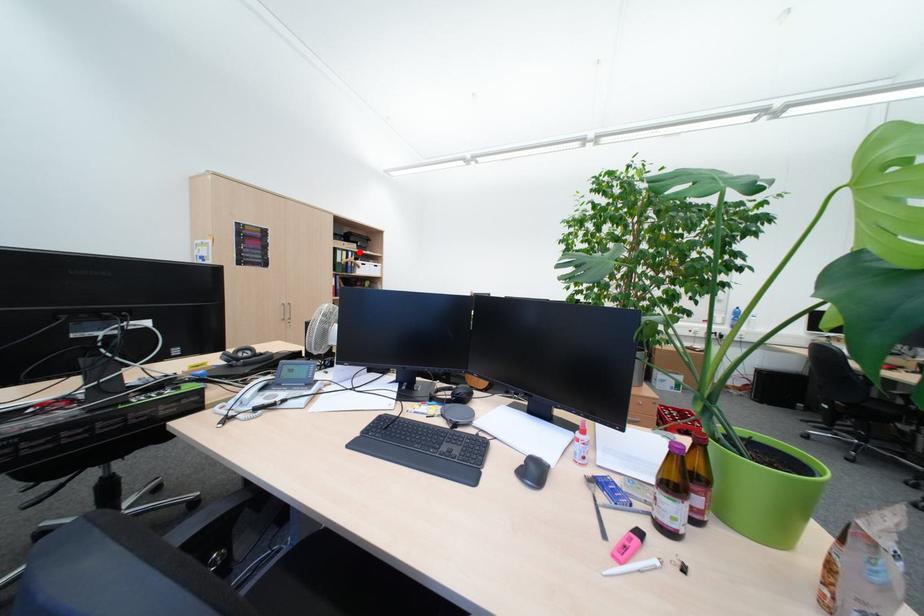
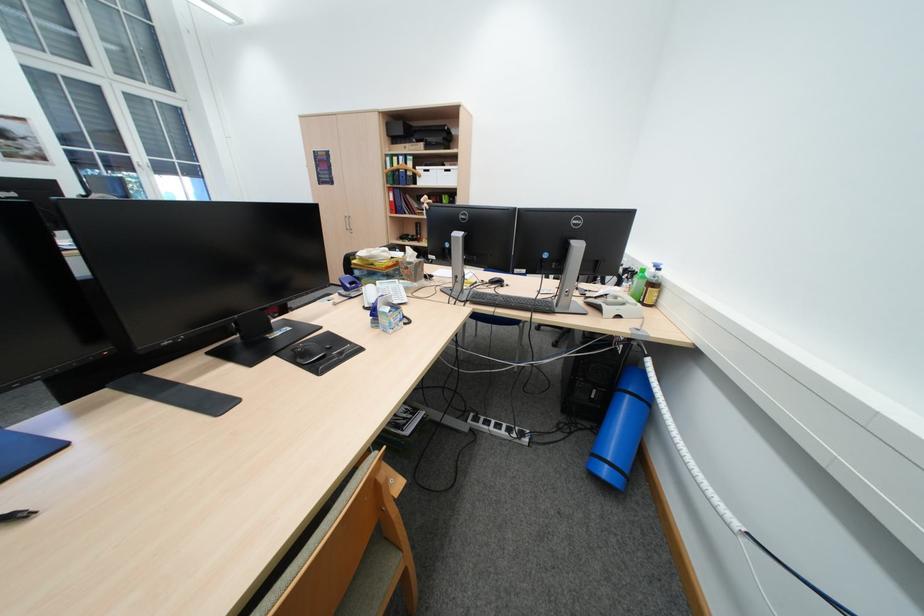
Question: I am providing you with two images of the same scene from different viewpoints. A red point is shown in image1. For the corresponding object point in image2, is it positioned nearer or farther from the camera?

Choices:
 (A) Nearer
 (B) Farther

Answer: (A)